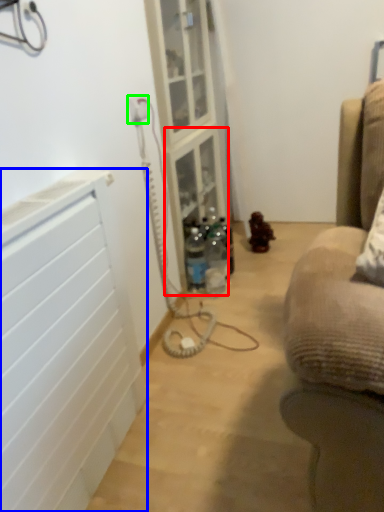
Question: Estimate the real-world distances between objects in this image. Which object is farther from shelf (highlighted by a red box), radiator (highlighted by a blue box) or electric outlet (highlighted by a green box)?

Choices:
 (A) radiator
 (B) electric outlet

Answer: (A)